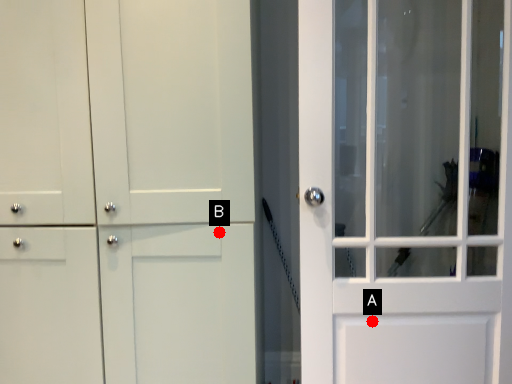
Question: Two points are circled on the image, labeled by A and B beside each circle. Among these points, which one is farthest from the camera?

Choices:
 (A) A is further
 (B) B is further

Answer: (A)